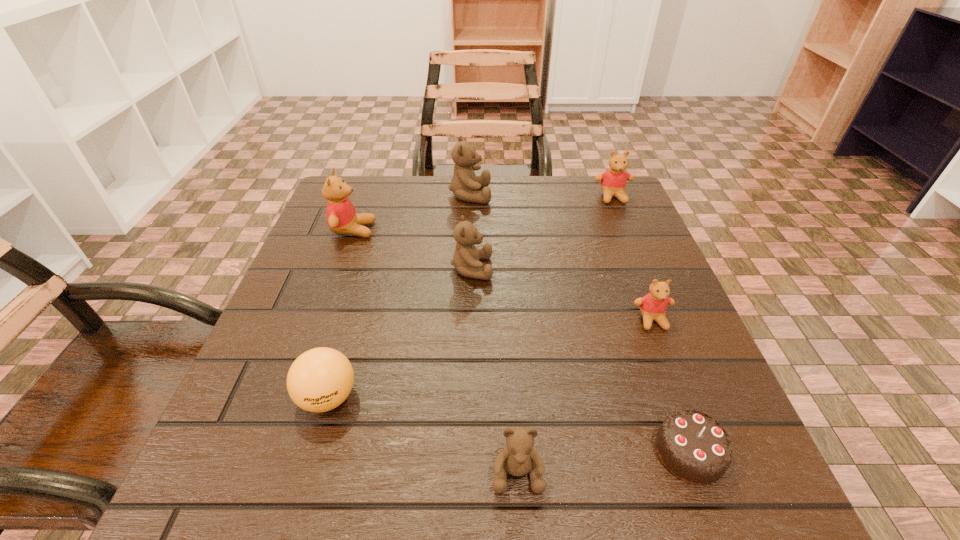
Image resolution: width=960 pixels, height=540 pixels. Identify the location of the farthest brown teddy bear. (464, 183).

What are the coordinates of `the biggest red teddy bear` in the screenshot? It's located at (341, 216).

Locate an element on the screen. This screenshot has height=540, width=960. the leftmost red teddy bear is located at coordinates coord(341,216).

Identify the location of the farthest red teddy bear. The image size is (960, 540). (613, 181).

Locate an element on the screen. the second smallest brown teddy bear is located at coordinates (466, 258).

At what (x,y) coordinates should I click in order to perform the action: click on the second farthest brown teddy bear. Please return your answer as a coordinate pair (x, y). Looking at the image, I should click on (466, 258).

Locate an element on the screen. ping-pong ball is located at coordinates (319, 380).

Locate an element on the screen. the fifth farthest teddy bear is located at coordinates (653, 306).

Find the location of `the fourth nearest object`. the fourth nearest object is located at coordinates (653, 306).

Find the location of a particular element. the nearest teddy bear is located at coordinates (518, 458).